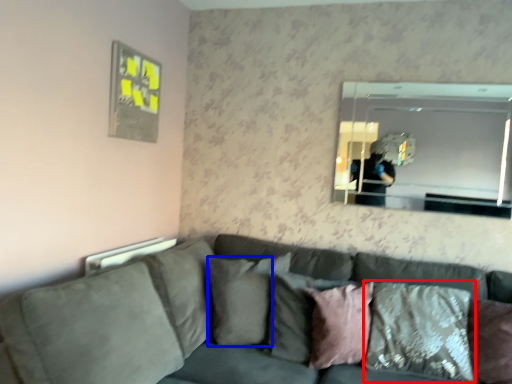
Question: Which of the following is the farthest to the observer, pillow (highlighted by a red box) or pillow (highlighted by a blue box)?

Choices:
 (A) pillow
 (B) pillow

Answer: (B)